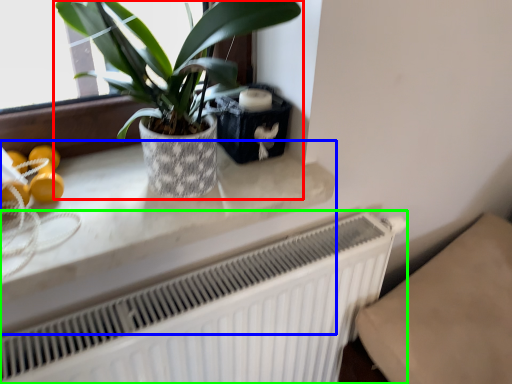
Question: Which object is positioned farthest from houseplant (highlighted by a red box)? Select from counter top (highlighted by a blue box) and radiator (highlighted by a green box).

Choices:
 (A) counter top
 (B) radiator

Answer: (B)